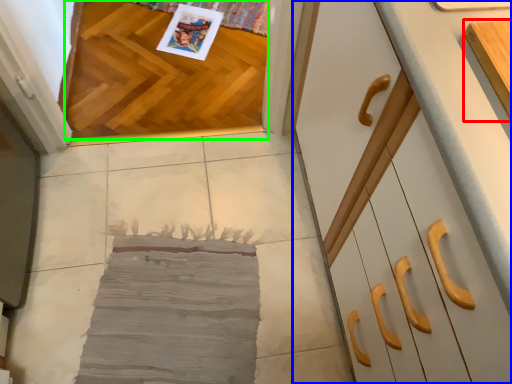
Question: Estimate the real-world distances between objects in this image. Which object is farther from cabinetry (highlighted by a red box), cabinetry (highlighted by a blue box) or hardwood (highlighted by a green box)?

Choices:
 (A) cabinetry
 (B) hardwood

Answer: (B)